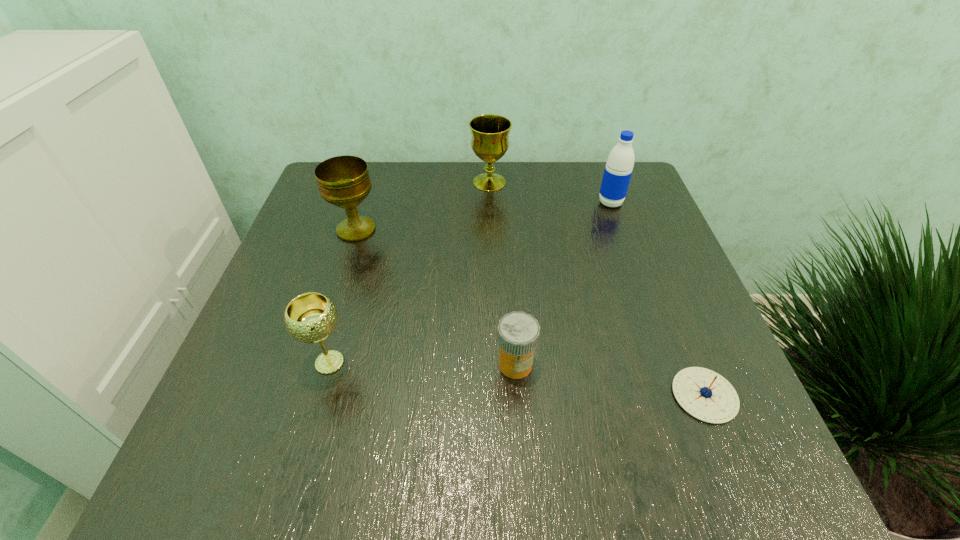
Identify which object is the fifth closest to the second nearest chalice. Please provide its 2D coordinates. Your answer should be formatted as a tuple, i.e. [(x, y)], where the tuple contains the x and y coordinates of a point satisfying the conditions above.

[(704, 394)]

The image size is (960, 540). I want to click on the second closest chalice to the nearest chalice, so click(x=490, y=141).

Locate which chalice ranks in proximity to the rightmost chalice. Please provide its 2D coordinates. Your answer should be formatted as a tuple, i.e. [(x, y)], where the tuple contains the x and y coordinates of a point satisfying the conditions above.

[(343, 181)]

You are a GUI agent. You are given a task and a screenshot of the screen. Output one action in this format:
    pyautogui.click(x=<x>, y=<y>)
    Task: Click on the free space that satisfies the following two spatial constraints: 1. on the front side of the compass; 2. on the right side of the nearest chalice
    This screenshot has height=540, width=960.
    Given the screenshot: What is the action you would take?
    pyautogui.click(x=321, y=395)

Locate an element on the screen. Image resolution: width=960 pixels, height=540 pixels. blank area in the image that satisfies the following two spatial constraints: 1. on the front side of the farthest object; 2. on the left side of the water bottle is located at coordinates (490, 202).

The height and width of the screenshot is (540, 960). What are the coordinates of `vacant region that satisfies the following two spatial constraints: 1. on the back side of the second nearest chalice; 2. on the left side of the farthest chalice` in the screenshot? It's located at (371, 182).